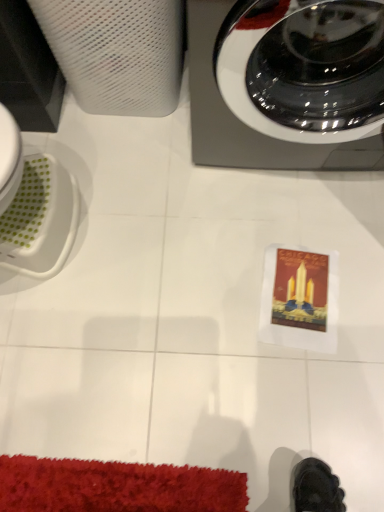
Question: From the image's perspective, is white mesh paper towel at upper left under metallic gray washing machine at upper right?

Choices:
 (A) yes
 (B) no

Answer: (B)

Question: Is white mesh paper towel at upper left smaller than metallic gray washing machine at upper right?

Choices:
 (A) no
 (B) yes

Answer: (B)

Question: Are white mesh paper towel at upper left and metallic gray washing machine at upper right located far from each other?

Choices:
 (A) yes
 (B) no

Answer: (B)

Question: Does white mesh paper towel at upper left have a lesser width compared to metallic gray washing machine at upper right?

Choices:
 (A) yes
 (B) no

Answer: (A)

Question: From a real-world perspective, is white mesh paper towel at upper left on metallic gray washing machine at upper right?

Choices:
 (A) no
 (B) yes

Answer: (A)

Question: Considering the relative positions of white mesh paper towel at upper left and metallic gray washing machine at upper right in the image provided, is white mesh paper towel at upper left to the left of metallic gray washing machine at upper right from the viewer's perspective?

Choices:
 (A) yes
 (B) no

Answer: (A)

Question: From a real-world perspective, is metallic gray washing machine at upper right on white mesh paper towel at upper left?

Choices:
 (A) no
 (B) yes

Answer: (B)

Question: From the image's perspective, would you say metallic gray washing machine at upper right is positioned over white mesh paper towel at upper left?

Choices:
 (A) yes
 (B) no

Answer: (B)

Question: Is metallic gray washing machine at upper right surrounding white mesh paper towel at upper left?

Choices:
 (A) yes
 (B) no

Answer: (B)

Question: Is metallic gray washing machine at upper right oriented away from white mesh paper towel at upper left?

Choices:
 (A) no
 (B) yes

Answer: (A)

Question: Is metallic gray washing machine at upper right not near white mesh paper towel at upper left?

Choices:
 (A) no
 (B) yes

Answer: (A)

Question: Is metallic gray washing machine at upper right not inside white mesh paper towel at upper left?

Choices:
 (A) no
 (B) yes

Answer: (B)

Question: In terms of height, does white mesh paper towel at upper left look taller or shorter compared to metallic gray washing machine at upper right?

Choices:
 (A) tall
 (B) short

Answer: (B)